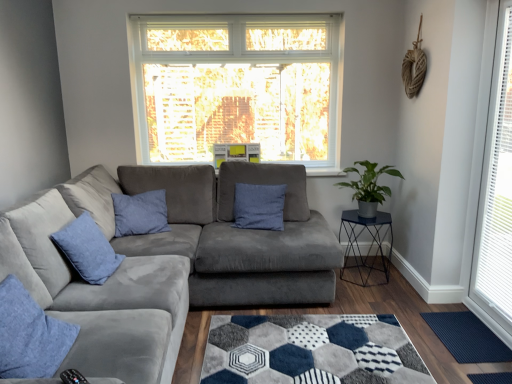
Question: From the image's perspective, is white plastic window at right positioned above or below green matte plant at right?

Choices:
 (A) above
 (B) below

Answer: (A)

Question: Does point (507, 84) appear closer or farther from the camera than point (364, 173)?

Choices:
 (A) farther
 (B) closer

Answer: (B)

Question: Considering the real-world distances, which object is closest to the green matte plant at right?

Choices:
 (A) suede gray couch at center
 (B) dark blue rubber mat at lower right
 (C) white plastic window at right
 (D) blue cotton pillow at center, arranged as the first pillow when viewed from the back
 (E) blue velvet pillow at left, acting as the 2th pillow starting from the front

Answer: (D)

Question: Which of these objects is positioned closest to the dark blue rubber mat at lower right?

Choices:
 (A) green matte plant at right
 (B) denim cushion at lower left, marked as the second pillow in a left-to-right arrangement
 (C) metallic blue cocktail table at right
 (D) blue cotton pillow at center, the third pillow in the left-to-right sequence
 (E) white plastic window at right

Answer: (E)